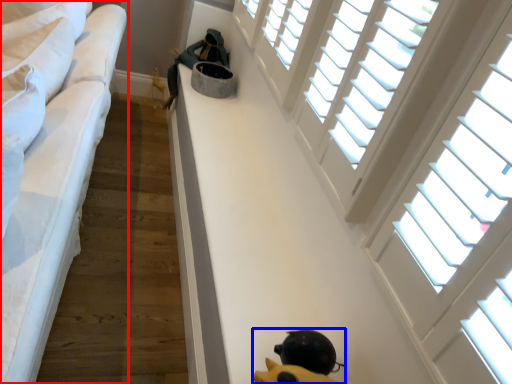
Question: Which point is further to the camera, furniture (highlighted by a red box) or toy (highlighted by a blue box)?

Choices:
 (A) furniture
 (B) toy

Answer: (B)